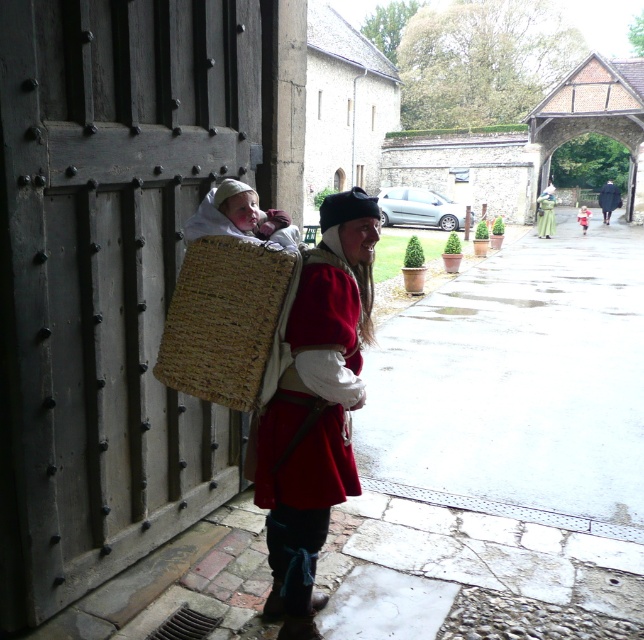
Which is behind, point (185, 358) or point (545, 220)?

Point (545, 220)

Who is positioned more to the right, woven straw basket at center or green woolen robe at center?

From the viewer's perspective, green woolen robe at center appears more on the right side.

Is point (256, 264) positioned after point (553, 211)?

No, it is not.

Where is `woven straw basket at center`? This screenshot has width=644, height=640. woven straw basket at center is located at coordinates (229, 321).

Does soft beige fabric at center appear on the left side of green woolen robe at center?

Indeed, soft beige fabric at center is positioned on the left side of green woolen robe at center.

Between point (287, 237) and point (540, 236), which one is positioned in front?

Point (287, 237)

Which is in front, point (214, 188) or point (540, 204)?

Point (214, 188) is more forward.

Where is `soft beige fabric at center`? soft beige fabric at center is located at coordinates (240, 218).

Looking at this image, between woven straw basket at center and soft beige fabric at center, which one appears on the left side from the viewer's perspective?

woven straw basket at center is more to the left.

Describe the element at coordinates (229, 321) in the screenshot. I see `woven straw basket at center` at that location.

The image size is (644, 640). Identify the location of woven straw basket at center. (229, 321).